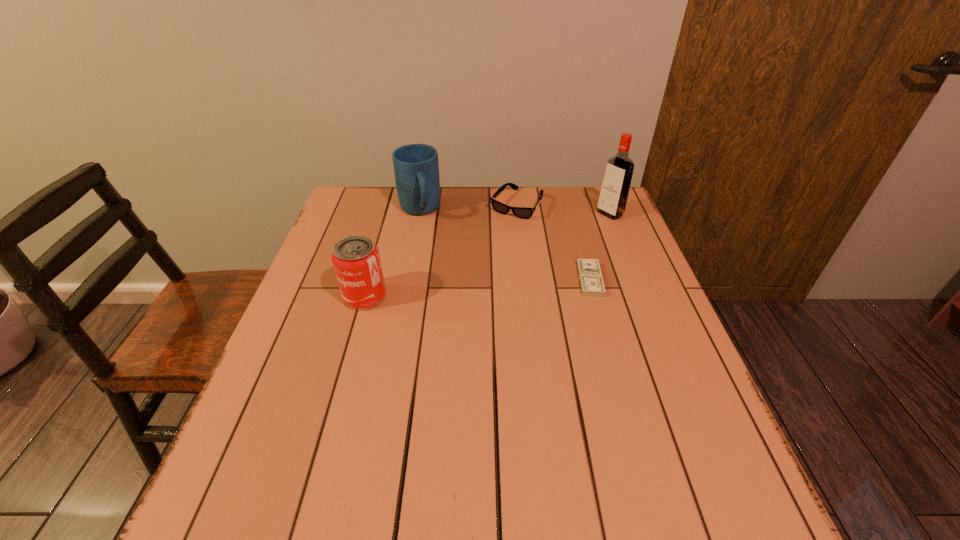
Locate an element on the screen. This screenshot has width=960, height=540. the third tallest object is located at coordinates (356, 260).

I want to click on money, so click(591, 281).

Identify the location of the shortest object. The width and height of the screenshot is (960, 540). (591, 281).

You are a GUI agent. You are given a task and a screenshot of the screen. Output one action in this format:
    pyautogui.click(x=<x>, y=<y>)
    Task: Click on the sunglasses
    
    Given the screenshot: What is the action you would take?
    pyautogui.click(x=521, y=212)

The image size is (960, 540). What are the coordinates of `the second shortest object` in the screenshot? It's located at (521, 212).

At what (x,y) coordinates should I click in order to perform the action: click on the rightmost object. Please return your answer as a coordinate pair (x, y). This screenshot has width=960, height=540. Looking at the image, I should click on (612, 201).

This screenshot has height=540, width=960. I want to click on vodka, so click(x=612, y=201).

Identify the location of mug. (416, 168).

Locate an element on the screen. The height and width of the screenshot is (540, 960). vacant space located 0.150m on the right of the third shortest object is located at coordinates (446, 296).

You are a GUI agent. You are given a task and a screenshot of the screen. Output one action in this format:
    pyautogui.click(x=<x>, y=<y>)
    Task: Click on the free space located on the back of the money
    
    Given the screenshot: What is the action you would take?
    pyautogui.click(x=566, y=195)